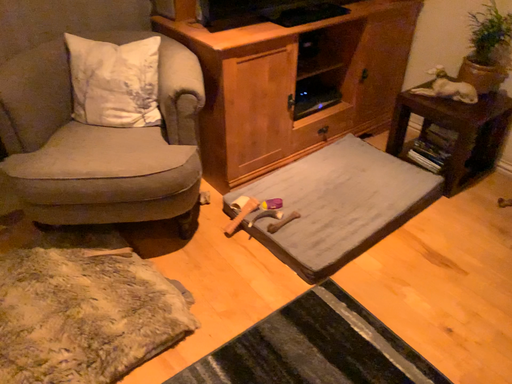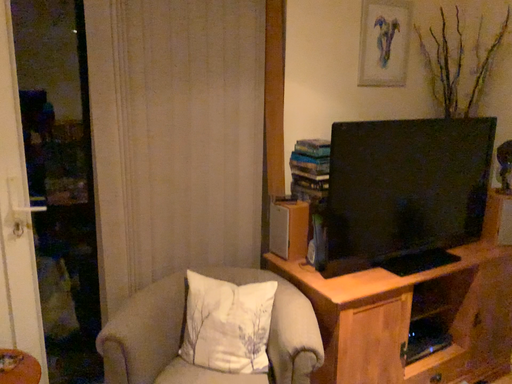
Question: How did the camera likely rotate when shooting the video?

Choices:
 (A) rotated upward
 (B) rotated downward

Answer: (A)